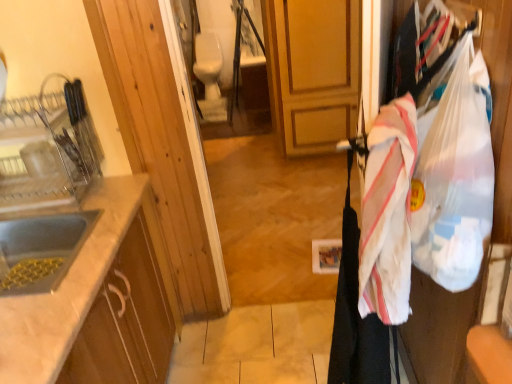
Question: Considering the relative sizes of white marble countertop at left and translucent plastic grocery bag at right in the image provided, is white marble countertop at left wider than translucent plastic grocery bag at right?

Choices:
 (A) no
 (B) yes

Answer: (B)

Question: From a real-world perspective, is white marble countertop at left located higher than translucent plastic grocery bag at right?

Choices:
 (A) no
 (B) yes

Answer: (A)

Question: Is the position of white marble countertop at left more distant than that of translucent plastic grocery bag at right?

Choices:
 (A) yes
 (B) no

Answer: (A)

Question: Is white marble countertop at left shorter than translucent plastic grocery bag at right?

Choices:
 (A) yes
 (B) no

Answer: (B)

Question: Is white marble countertop at left not inside translucent plastic grocery bag at right?

Choices:
 (A) no
 (B) yes

Answer: (B)

Question: From a real-world perspective, relative to white striped fabric at right, is translucent plastic grocery bag at right vertically above or below?

Choices:
 (A) above
 (B) below

Answer: (A)

Question: Is translucent plastic grocery bag at right taller or shorter than white striped fabric at right?

Choices:
 (A) tall
 (B) short

Answer: (B)

Question: Considering their positions, is translucent plastic grocery bag at right located in front of or behind white striped fabric at right?

Choices:
 (A) behind
 (B) front

Answer: (B)

Question: Based on their sizes in the image, would you say translucent plastic grocery bag at right is bigger or smaller than white striped fabric at right?

Choices:
 (A) big
 (B) small

Answer: (A)

Question: From the image's perspective, is matte silver sink at left, the 2th sink in the bottom-to-top sequence, located above or below white striped fabric at right?

Choices:
 (A) below
 (B) above

Answer: (B)

Question: Is matte silver sink at left, the 2th sink in the bottom-to-top sequence, wider or thinner than white striped fabric at right?

Choices:
 (A) thin
 (B) wide

Answer: (B)

Question: In the image, is matte silver sink at left, the 2th sink in the bottom-to-top sequence, on the left side or the right side of white striped fabric at right?

Choices:
 (A) right
 (B) left

Answer: (B)

Question: Is point (2, 114) closer or farther from the camera than point (401, 152)?

Choices:
 (A) closer
 (B) farther

Answer: (B)

Question: From a real-world perspective, is white matte sink at left, which is the 2th sink from top to bottom, positioned above or below white striped fabric at right?

Choices:
 (A) below
 (B) above

Answer: (A)

Question: In the image, is white matte sink at left, which is the 2th sink from top to bottom, on the left side or the right side of white striped fabric at right?

Choices:
 (A) right
 (B) left

Answer: (B)